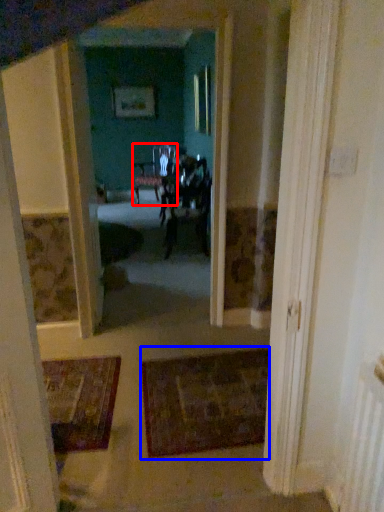
Question: Which point is further to the camera, chair (highlighted by a red box) or doormat (highlighted by a blue box)?

Choices:
 (A) chair
 (B) doormat

Answer: (A)